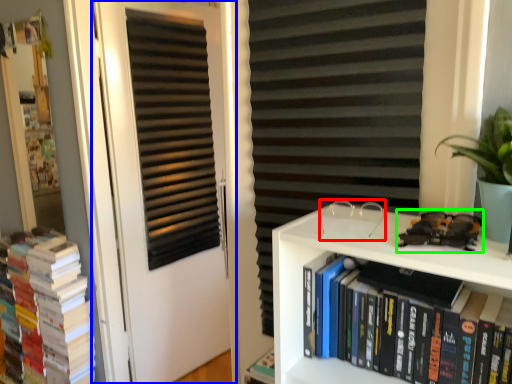
Question: Based on their relative distances, which object is nearer to glasses (highlighted by a red box)? Choose from door (highlighted by a blue box) and toy car (highlighted by a green box).

Choices:
 (A) door
 (B) toy car

Answer: (B)